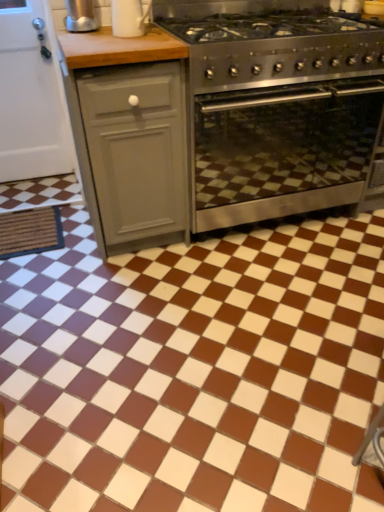
Describe the element at coordinates (270, 42) in the screenshot. Image resolution: width=384 pixels, height=512 pixels. I see `stainless steel gas stove at center` at that location.

Measure the distance between point (127, 44) and camera.

Point (127, 44) and camera are 1.57 meters apart.

This screenshot has width=384, height=512. What do you see at coordinates (195, 371) in the screenshot? I see `brown glossy tile at center` at bounding box center [195, 371].

The height and width of the screenshot is (512, 384). In order to click on white glossy mug at upper center in this screenshot , I will do `click(128, 18)`.

Is stainless steel gas stove at center next to satin silver kettle at upper left and touching it?

They are not placed beside each other.

From the image's perspective, is stainless steel gas stove at center located above or below satin silver kettle at upper left?

Clearly, from the image's perspective, stainless steel gas stove at center is below satin silver kettle at upper left.

How distant is stainless steel gas stove at center from satin silver kettle at upper left?

stainless steel gas stove at center is 25.32 inches away from satin silver kettle at upper left.

From a real-world perspective, which object stands above the other?

satin silver kettle at upper left, from a real-world perspective.

Is satin silver kettle at upper left thinner than white glossy mug at upper center?

Correct, the width of satin silver kettle at upper left is less than that of white glossy mug at upper center.

Is point (68, 11) behind point (136, 11)?

Yes, point (68, 11) is farther from viewer.

Considering the relative positions of satin silver kettle at upper left and white glossy mug at upper center in the image provided, is satin silver kettle at upper left behind white glossy mug at upper center?

Yes, the depth of satin silver kettle at upper left is greater than that of white glossy mug at upper center.

Is satin silver kettle at upper left bigger or smaller than white glossy mug at upper center?

Clearly, satin silver kettle at upper left is smaller in size than white glossy mug at upper center.

Is gray matte cabinet at left outside of brown glossy tile at center?

Yes.

Locate an element on the screen. cabinetry that is on the left side of brown glossy tile at center is located at coordinates point(129,135).

Could you tell me if gray matte cabinet at left is facing brown glossy tile at center?

No, gray matte cabinet at left is not oriented towards brown glossy tile at center.

Who is more distant, brown glossy tile at center or stainless steel gas stove at center?

stainless steel gas stove at center is more distant.

From a real-world perspective, which object rests below the other?

brown glossy tile at center, from a real-world perspective.

Locate an element on the screen. The image size is (384, 512). gas stove behind the brown glossy tile at center is located at coordinates pos(270,42).

Which is less distant, (169, 436) or (252, 38)?

Point (169, 436).

From the picture: Considering the relative sizes of satin silver kettle at upper left and stainless steel gas stove at center in the image provided, is satin silver kettle at upper left thinner than stainless steel gas stove at center?

Correct, the width of satin silver kettle at upper left is less than that of stainless steel gas stove at center.

Which object is positioned more to the left, satin silver kettle at upper left or stainless steel gas stove at center?

Positioned to the left is satin silver kettle at upper left.

At what (x,y) coordinates should I click in order to perform the action: click on gas stove below the satin silver kettle at upper left (from the image's perspective). Please return your answer as a coordinate pair (x, y). Looking at the image, I should click on (270, 42).

Is satin silver kettle at upper left turned away from stainless steel gas stove at center?

No, satin silver kettle at upper left's orientation is not away from stainless steel gas stove at center.

Which object is further away from the camera, stainless steel oven at center or stainless steel gas stove at center?

Positioned behind is stainless steel oven at center.

Based on the photo, is stainless steel oven at center wider or thinner than stainless steel gas stove at center?

stainless steel oven at center is thinner than stainless steel gas stove at center.

Does stainless steel oven at center have a lesser height compared to stainless steel gas stove at center?

In fact, stainless steel oven at center may be taller than stainless steel gas stove at center.

What's the angular difference between stainless steel oven at center and stainless steel gas stove at center's facing directions?

The angle between the facing direction of stainless steel oven at center and the facing direction of stainless steel gas stove at center is 0.0975 degrees.

Is point (273, 71) closer to camera compared to point (64, 304)?

Yes.

Considering the sizes of objects stainless steel gas stove at center and brown glossy tile at center in the image provided, who is bigger, stainless steel gas stove at center or brown glossy tile at center?

Bigger between the two is brown glossy tile at center.

From the image's perspective, is stainless steel gas stove at center beneath brown glossy tile at center?

Actually, stainless steel gas stove at center appears above brown glossy tile at center in the image.

Between stainless steel gas stove at center and brown glossy tile at center, which one is positioned behind?

stainless steel gas stove at center is further from the camera.

Locate an element on the screen. The width and height of the screenshot is (384, 512). appliance lying behind the stainless steel gas stove at center is located at coordinates (80, 16).

The width and height of the screenshot is (384, 512). I want to click on appliance on the left of white glossy mug at upper center, so (80, 16).

Looking at the image, which one is located closer to gray matte cabinet at left, satin silver kettle at upper left or brown glossy tile at center?

The object closer to gray matte cabinet at left is satin silver kettle at upper left.

Based on their spatial positions, is satin silver kettle at upper left or stainless steel gas stove at center closer to gray matte cabinet at left?

stainless steel gas stove at center is positioned closer to the anchor gray matte cabinet at left.

Considering their positions, is stainless steel oven at center positioned closer to stainless steel gas stove at center than satin silver kettle at upper left?

stainless steel oven at center is positioned closer to the anchor stainless steel gas stove at center.

Based on their spatial positions, is stainless steel oven at center or gray matte cabinet at left further from stainless steel gas stove at center?

gray matte cabinet at left is further to stainless steel gas stove at center.

Looking at the image, which one is located further to satin silver kettle at upper left, white glossy mug at upper center or stainless steel oven at center?

The object further to satin silver kettle at upper left is stainless steel oven at center.

Estimate the real-world distances between objects in this image. Which object is further from brown glossy tile at center, satin silver kettle at upper left or gray matte cabinet at left?

satin silver kettle at upper left lies further to brown glossy tile at center than the other object.

From the image, which object appears to be farther from stainless steel oven at center, satin silver kettle at upper left or white glossy mug at upper center?

Among the two, satin silver kettle at upper left is located further to stainless steel oven at center.

From the image, which object appears to be nearer to stainless steel gas stove at center, white glossy mug at upper center or stainless steel oven at center?

stainless steel oven at center is positioned closer to the anchor stainless steel gas stove at center.

This screenshot has width=384, height=512. Find the location of `kitchen appliance between stainless steel gas stove at center and brown glossy tile at center vertically`. kitchen appliance between stainless steel gas stove at center and brown glossy tile at center vertically is located at coordinates (128, 18).

Where is `kitchen appliance situated between gray matte cabinet at left and stainless steel gas stove at center from left to right`? This screenshot has width=384, height=512. kitchen appliance situated between gray matte cabinet at left and stainless steel gas stove at center from left to right is located at coordinates (128, 18).

The height and width of the screenshot is (512, 384). Find the location of `gas stove between white glossy mug at upper center and stainless steel oven at center`. gas stove between white glossy mug at upper center and stainless steel oven at center is located at coordinates (270, 42).

Find the location of a particular element. cabinetry located between satin silver kettle at upper left and stainless steel gas stove at center in the left-right direction is located at coordinates (129, 135).